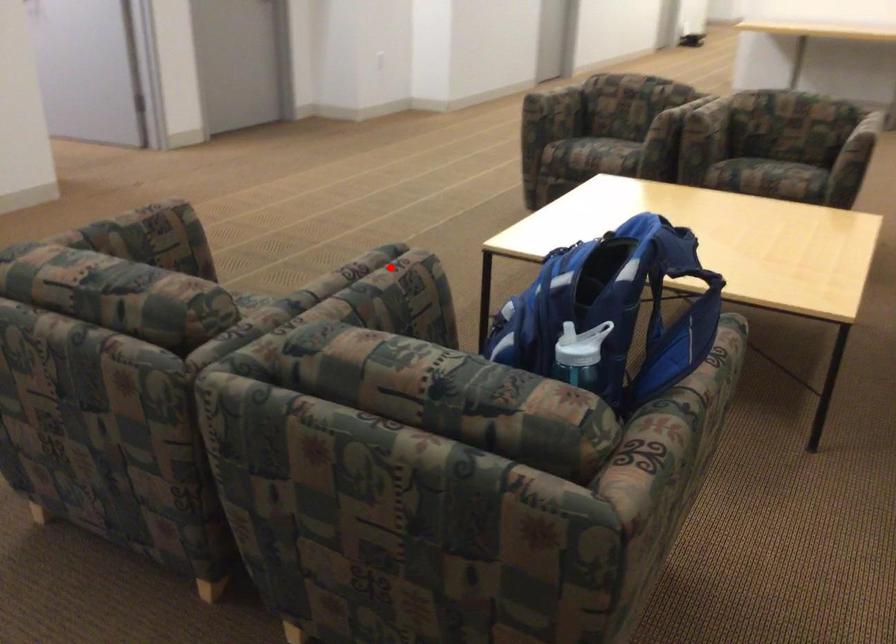
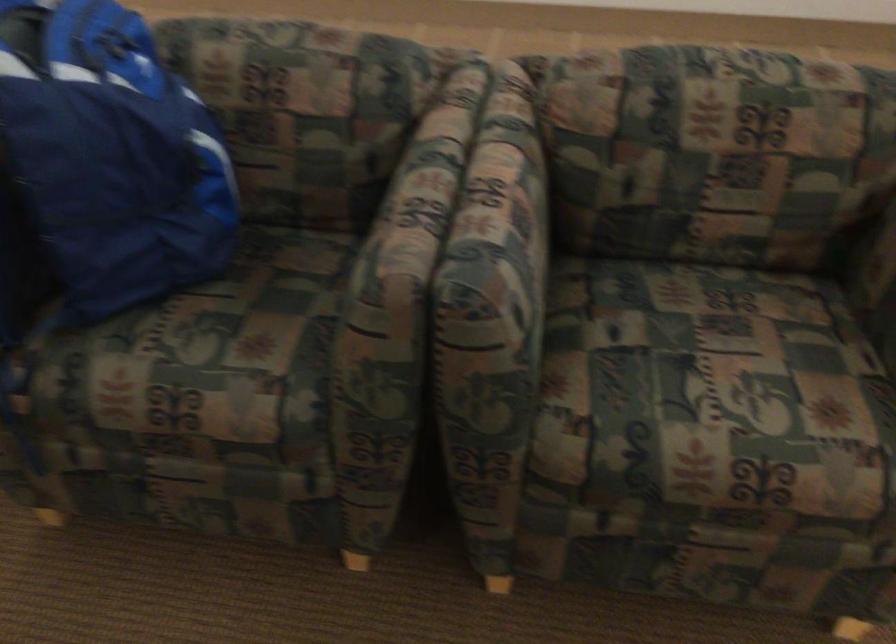
Locate, in the second image, the point that corresponds to the highlighted location in the first image.

(412, 207)